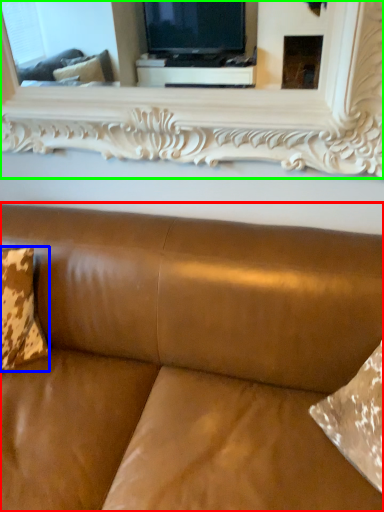
Question: Which object is the closest to the studio couch (highlighted by a red box)? Choose among these: pillow (highlighted by a blue box) or mirror (highlighted by a green box).

Choices:
 (A) pillow
 (B) mirror

Answer: (A)